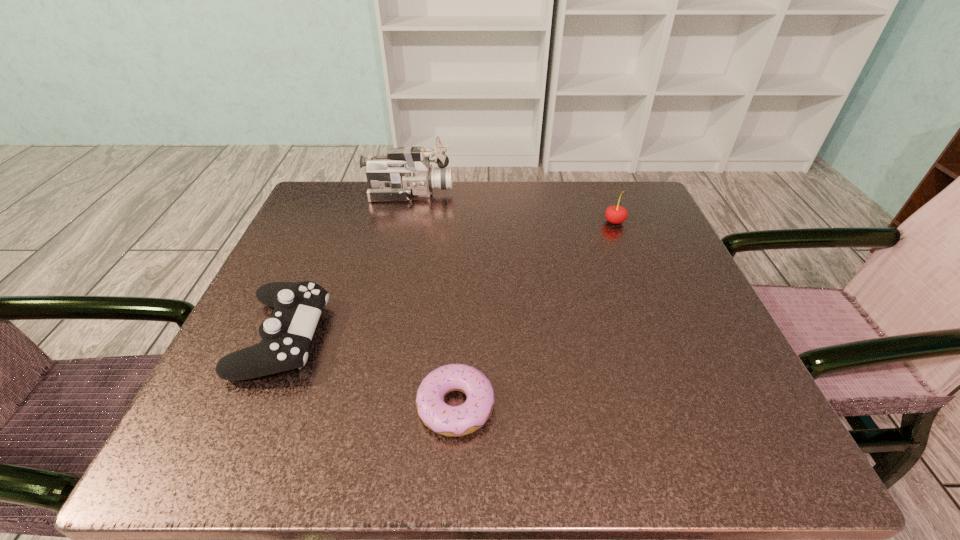
You are a GUI agent. You are given a task and a screenshot of the screen. Output one action in this format:
    pyautogui.click(x=<x>, y=<y>)
    Task: Click on the camcorder at the far edge
    The image size is (960, 540).
    Given the screenshot: What is the action you would take?
    [405, 173]

This screenshot has height=540, width=960. In order to click on cherry located at the far edge in this screenshot , I will do `click(614, 214)`.

The height and width of the screenshot is (540, 960). I want to click on object located in the near edge section of the desktop, so click(452, 421).

This screenshot has width=960, height=540. I want to click on camcorder present at the left edge, so 405,173.

The height and width of the screenshot is (540, 960). I want to click on control at the left edge, so click(x=286, y=335).

Find the location of `object that is at the right edge`. object that is at the right edge is located at coordinates (614, 214).

I want to click on object that is at the far left corner, so click(405, 173).

The width and height of the screenshot is (960, 540). What are the coordinates of `object at the far right corner` in the screenshot? It's located at (614, 214).

The width and height of the screenshot is (960, 540). I want to click on free space at the far edge of the desktop, so click(x=540, y=202).

The height and width of the screenshot is (540, 960). In the image, there is a desktop. Find the location of `free space at the left edge`. free space at the left edge is located at coordinates (319, 325).